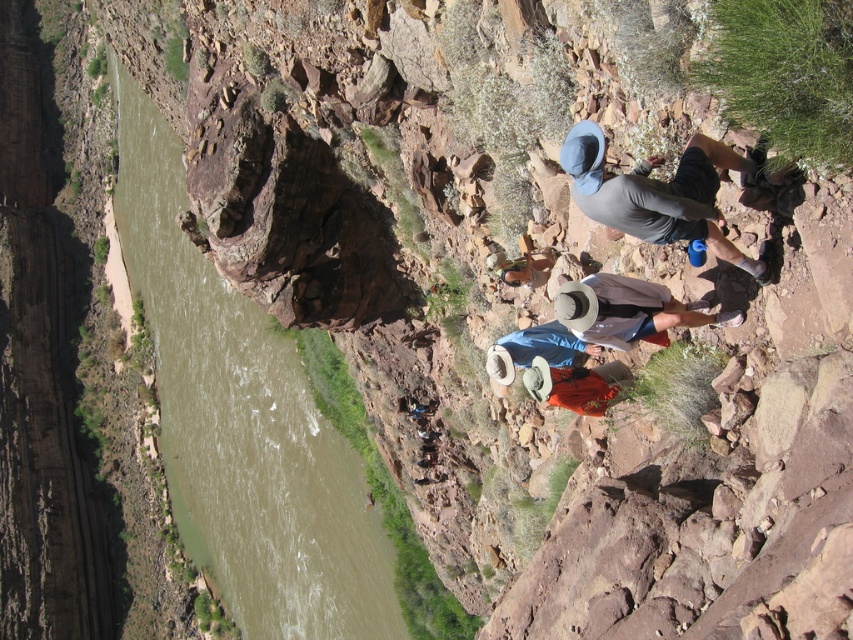
Question: Is brown rock at center thinner than gray fabric hat at upper right?

Choices:
 (A) yes
 (B) no

Answer: (B)

Question: Is brown rock at center above gray fabric hat at upper right?

Choices:
 (A) no
 (B) yes

Answer: (A)

Question: Where is brown rock at center located in relation to gray fabric hat at upper right in the image?

Choices:
 (A) right
 (B) left

Answer: (B)